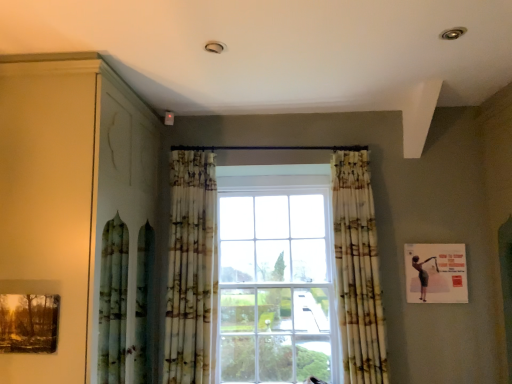
Question: In terms of width, does matte wood dresser at left look wider or thinner when compared to printed fabric curtain at center, the second curtain in the right-to-left sequence?

Choices:
 (A) wide
 (B) thin

Answer: (A)

Question: From the image's perspective, relative to printed fabric curtain at center, the second curtain in the right-to-left sequence, is matte wood dresser at left above or below?

Choices:
 (A) below
 (B) above

Answer: (B)

Question: Which object is positioned closest to the matte black picture frame at upper right, which is the 1th picture frame from right to left?

Choices:
 (A) matte wood dresser at left
 (B) matte wooden picture frame at lower left, which is the 1th picture frame from front to back
 (C) printed fabric curtain at center, the second curtain in the right-to-left sequence
 (D) printed fabric curtain at center, the second curtain when ordered from left to right

Answer: (D)

Question: Which of these objects is positioned farthest from the printed fabric curtain at center, the second curtain in the right-to-left sequence?

Choices:
 (A) matte wooden picture frame at lower left, placed as the 2th picture frame when sorted from back to front
 (B) matte black picture frame at upper right, the second picture frame viewed from the left
 (C) printed fabric curtain at center, the second curtain when ordered from left to right
 (D) matte wood dresser at left

Answer: (B)